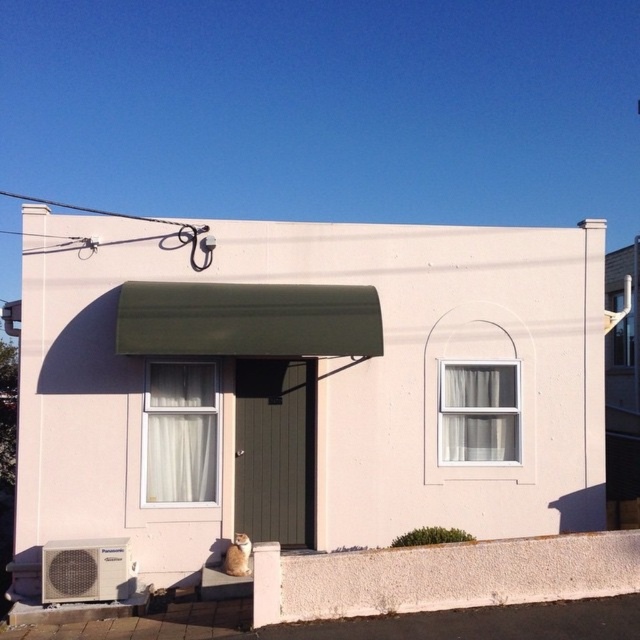
You are standing in front of the house and want to compare the curtains. Which curtain has a wider width, the white sheer curtain at center or the white sheer curtain at upper right?

The white sheer curtain at upper right has a greater width compared to the white sheer curtain at center.

You are standing at point A located at point (x=152, y=456). You want to walk to the house. Which direction should you go to reach the house?

The point (x=152, y=456) is 9.58 meters away from the house. To reach the house, you should walk towards it from the point (x=152, y=456).

From the picture: You are standing in front of the house and want to enter through the front door. Which object, the white matte shed at center or the white sheer curtain at upper right, is closer to you as you approach the door?

The white matte shed at center is closer to you because it is positioned at the center, while the white sheer curtain at upper right is located higher up and further away.